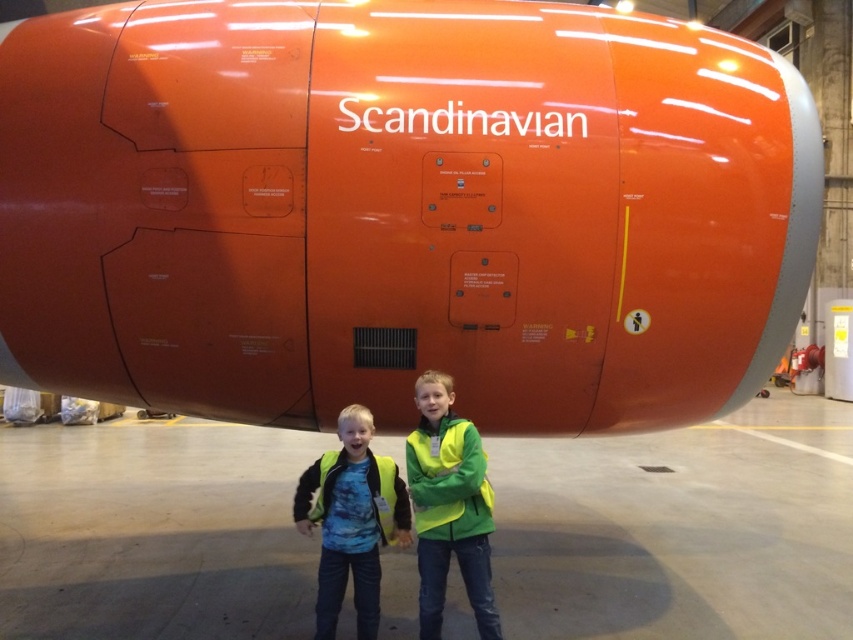
Question: Can you confirm if orange matte airplane at center is smaller than yellow reflective vests at center?

Choices:
 (A) yes
 (B) no

Answer: (B)

Question: Estimate the real-world distances between objects in this image. Which object is farther from the green matte jacket at center?

Choices:
 (A) yellow reflective vests at center
 (B) orange matte airplane at center
 (C) yellow reflective vest at center

Answer: (B)

Question: Which point is farther to the camera?

Choices:
 (A) yellow reflective vests at center
 (B) orange matte airplane at center

Answer: (A)

Question: Is orange matte airplane at center further to camera compared to yellow reflective vests at center?

Choices:
 (A) yes
 (B) no

Answer: (B)

Question: Considering the real-world distances, which object is closest to the yellow reflective vest at center?

Choices:
 (A) yellow reflective vests at center
 (B) green matte jacket at center
 (C) orange matte airplane at center

Answer: (A)

Question: Does yellow reflective vests at center appear on the right side of green matte jacket at center?

Choices:
 (A) no
 (B) yes

Answer: (A)